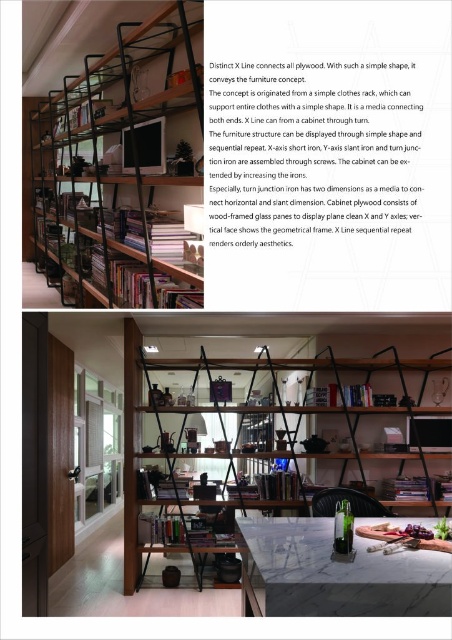
Question: Which point is closer to the camera?

Choices:
 (A) (269, 388)
 (B) (141, 241)

Answer: (B)

Question: Which of the following is the farthest from the observer?

Choices:
 (A) black matte bookshelf at upper left
 (B) matte black shelving unit at center

Answer: (B)

Question: Considering the relative positions of black matte bookshelf at upper left and matte black shelving unit at center in the image provided, where is black matte bookshelf at upper left located with respect to matte black shelving unit at center?

Choices:
 (A) above
 (B) below

Answer: (A)

Question: Does black matte bookshelf at upper left appear under matte black shelving unit at center?

Choices:
 (A) no
 (B) yes

Answer: (A)

Question: Considering the relative positions of black matte bookshelf at upper left and matte black shelving unit at center in the image provided, where is black matte bookshelf at upper left located with respect to matte black shelving unit at center?

Choices:
 (A) left
 (B) right

Answer: (A)

Question: Which of the following is the farthest from the observer?

Choices:
 (A) matte black shelving unit at center
 (B) black matte bookshelf at upper left

Answer: (A)